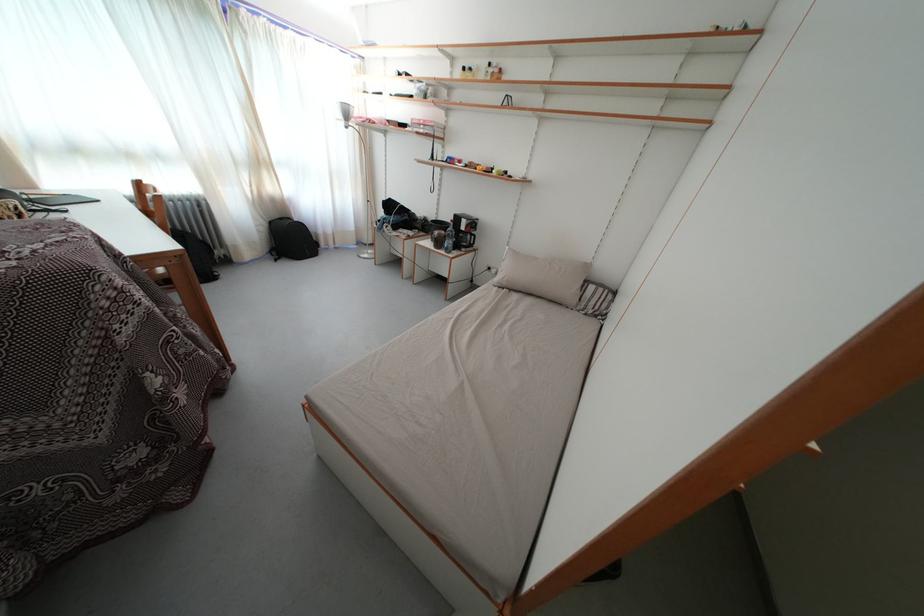
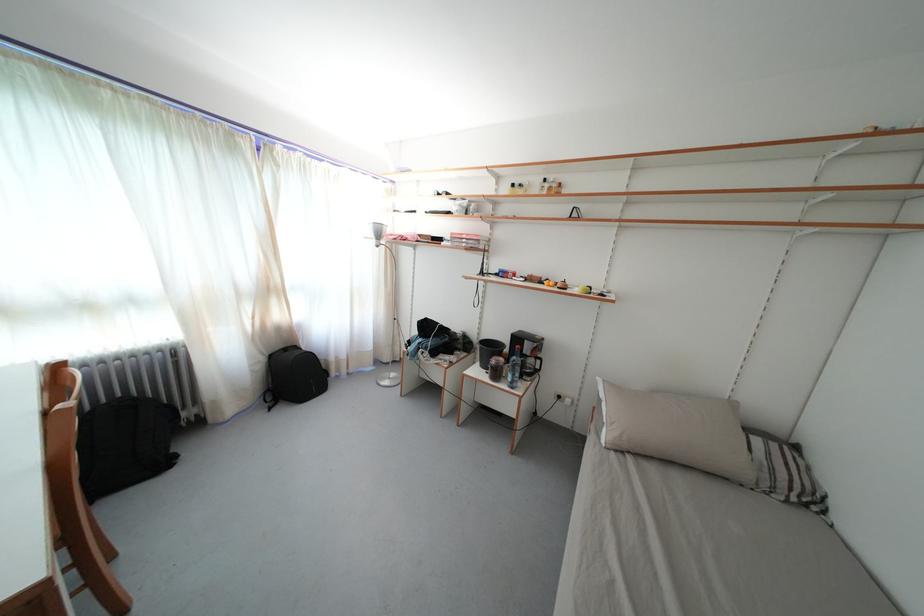
Question: The images are taken continuously from a first-person perspective. In which direction is your viewpoint rotating?

Choices:
 (A) Left
 (B) Right
 (C) Up
 (D) Down

Answer: (C)